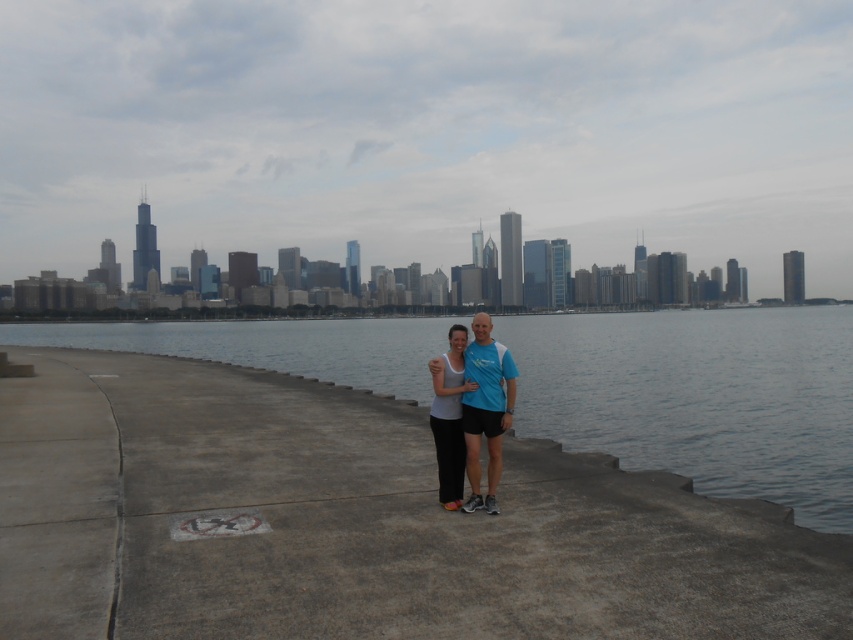
You are a photographer trying to capture both the blue fabric shirt at center and the white matte tank top at center in a single shot. Which of the two clothing items will appear larger in the photo?

The blue fabric shirt at center will appear larger in the photo because it is closer to the viewer than the white matte tank top at center.

You are a photographer trying to capture a photo of the clear water at center and the blue fabric shirt at center. Based on their positions, which object is located higher in the image?

The clear water at center is positioned over the blue fabric shirt at center, so the clear water at center is higher.